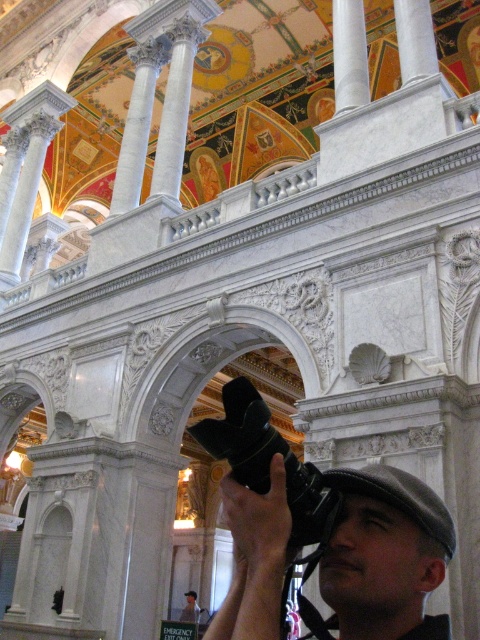
You are an interior designer planning to install a decorative element between the black matte camera at center and the white marble pillar at upper center. Considering their widths, which object should you place closer to the narrower one to ensure proper alignment?

The white marble pillar at upper center is narrower than the black matte camera at center. Therefore, you should place the decorative element closer to the white marble pillar at upper center to align with its narrower width.

You are an interior designer who wants to install a surveillance system in the grand building. You have two devices available, the black matte camera at center and the black matte video camera at center. Which device is shorter in height and better suited for discreet placement?

The black matte camera at center has a lesser height compared to the black matte video camera at center, making it better suited for discreet placement.

What is the object located at the coordinates point (x=268, y=461) in the image?

The point (x=268, y=461) indicates the location of the black matte video camera at center.